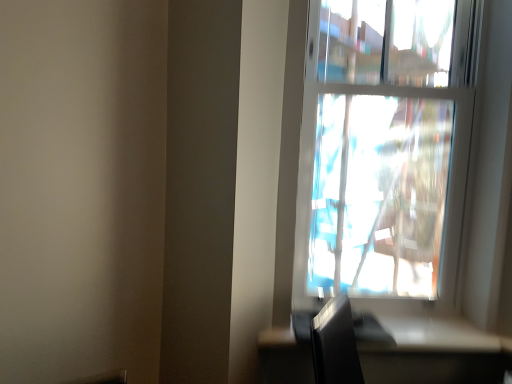
Question: From the image's perspective, is satin black table at lower right above or below transparent glass window at upper right?

Choices:
 (A) above
 (B) below

Answer: (B)

Question: From their relative heights in the image, would you say satin black table at lower right is taller or shorter than transparent glass window at upper right?

Choices:
 (A) short
 (B) tall

Answer: (A)

Question: In the image, is satin black table at lower right positioned in front of or behind transparent glass window at upper right?

Choices:
 (A) behind
 (B) front

Answer: (B)

Question: Considering their positions, is transparent glass window at upper right located in front of or behind satin black table at lower right?

Choices:
 (A) behind
 (B) front

Answer: (A)

Question: Considering the relative positions of transparent glass window at upper right and satin black table at lower right in the image provided, is transparent glass window at upper right to the left or to the right of satin black table at lower right?

Choices:
 (A) right
 (B) left

Answer: (A)

Question: From the image's perspective, is transparent glass window at upper right positioned above or below satin black table at lower right?

Choices:
 (A) below
 (B) above

Answer: (B)

Question: Considering the positions of transparent glass window at upper right and satin black table at lower right in the image, is transparent glass window at upper right taller or shorter than satin black table at lower right?

Choices:
 (A) tall
 (B) short

Answer: (A)